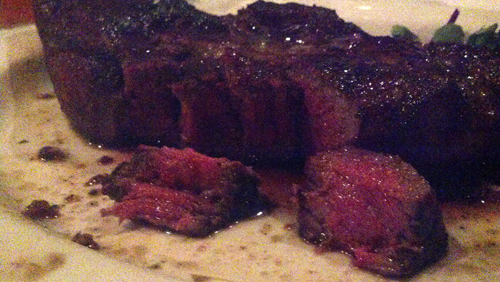
The image size is (500, 282). I want to click on plate, so click(38, 173).